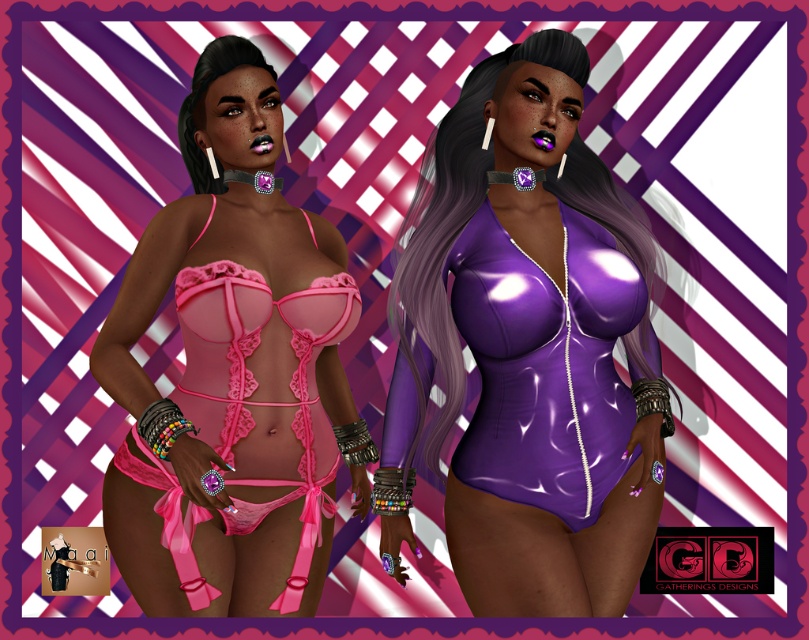
Question: Which object is closer to the camera taking this photo?

Choices:
 (A) shiny purple bodysuit at right
 (B) matte pink lingerie at upper left

Answer: (A)

Question: In this image, where is shiny purple bodysuit at right located relative to matte pink lingerie at upper left?

Choices:
 (A) below
 (B) above

Answer: (A)

Question: Is matte pink lingerie at center thinner than shiny purple bodysuit at right?

Choices:
 (A) yes
 (B) no

Answer: (B)

Question: Among these points, which one is farthest from the camera?

Choices:
 (A) (198, 164)
 (B) (528, 269)
 (C) (291, 262)

Answer: (A)

Question: Is matte purple bodysuit at center positioned before shiny purple bodysuit at right?

Choices:
 (A) yes
 (B) no

Answer: (B)

Question: Which is nearer to the shiny purple bodysuit at right?

Choices:
 (A) matte pink lingerie at upper left
 (B) matte purple bodysuit at center

Answer: (B)